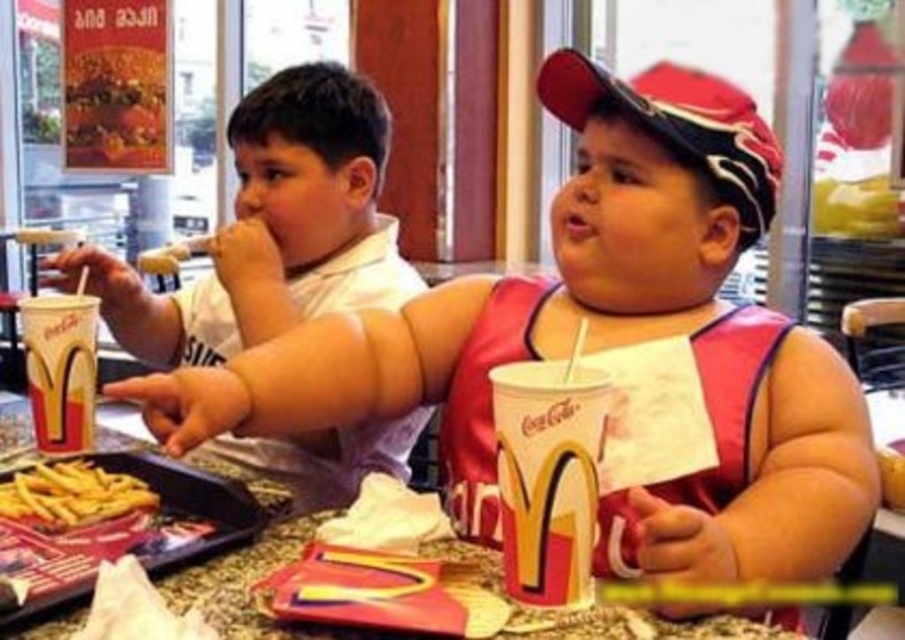
Question: Does matte paper cup at lower left have a smaller size compared to yellow crispy french fries at lower left?

Choices:
 (A) no
 (B) yes

Answer: (A)

Question: Which object is farther from the camera taking this photo?

Choices:
 (A) white matte shirt at upper left
 (B) yellow matte french fries at lower left

Answer: (A)

Question: Is matte paper cup at center positioned at the back of yellow crispy french fries at lower left?

Choices:
 (A) yes
 (B) no

Answer: (B)

Question: Which of these objects is positioned farthest from the matte paper cup at lower left?

Choices:
 (A) yellow crispy french fries at lower left
 (B) white matte shirt at upper left
 (C) yellow matte french fries at lower left
 (D) matte paper cup at center

Answer: (D)

Question: Which of the following is the farthest from the observer?

Choices:
 (A) click(94, 467)
 (B) click(580, 380)
 (C) click(37, 545)

Answer: (A)

Question: Does white matte shirt at upper left appear under matte paper cup at lower left?

Choices:
 (A) yes
 (B) no

Answer: (B)